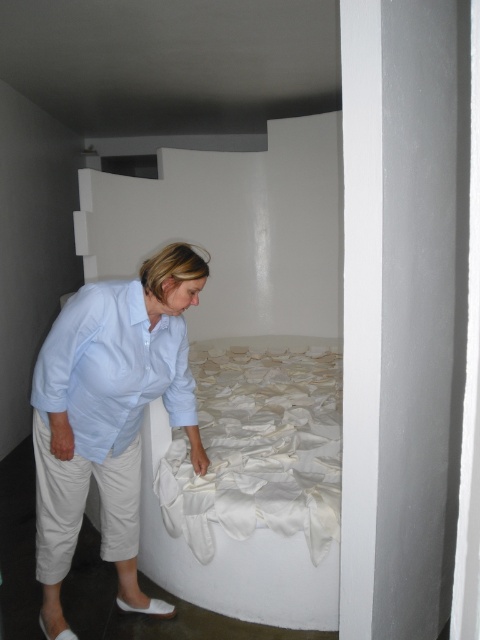
Who is higher up, white fabric bed at center or white satin sheet at center?

white fabric bed at center is above.

Can you confirm if white fabric bed at center is shorter than white satin sheet at center?

Incorrect, white fabric bed at center's height does not fall short of white satin sheet at center's.

Does point (269, 179) lie in front of point (230, 369)?

No, it is not.

The height and width of the screenshot is (640, 480). I want to click on white fabric bed at center, so click(235, 230).

Which is above, white satin sheet at center or light blue cotton shirt at lower left?

light blue cotton shirt at lower left is above.

Is point (301, 355) closer to camera compared to point (79, 301)?

No, it is behind (79, 301).

Who is more forward, (213, 506) or (122, 449)?

Point (122, 449)

Where is `white satin sheet at center`? The image size is (480, 640). white satin sheet at center is located at coordinates (259, 448).

Who is more forward, [117,531] or [336,458]?

Point [117,531]

Who is positioned more to the left, light blue shirt at center or white satin sheet at center?

Positioned to the left is light blue shirt at center.

Is point (60, 333) positioned in front of point (200, 512)?

Yes, point (60, 333) is in front of point (200, 512).

The image size is (480, 640). Find the location of `light blue shirt at center`. light blue shirt at center is located at coordinates (108, 416).